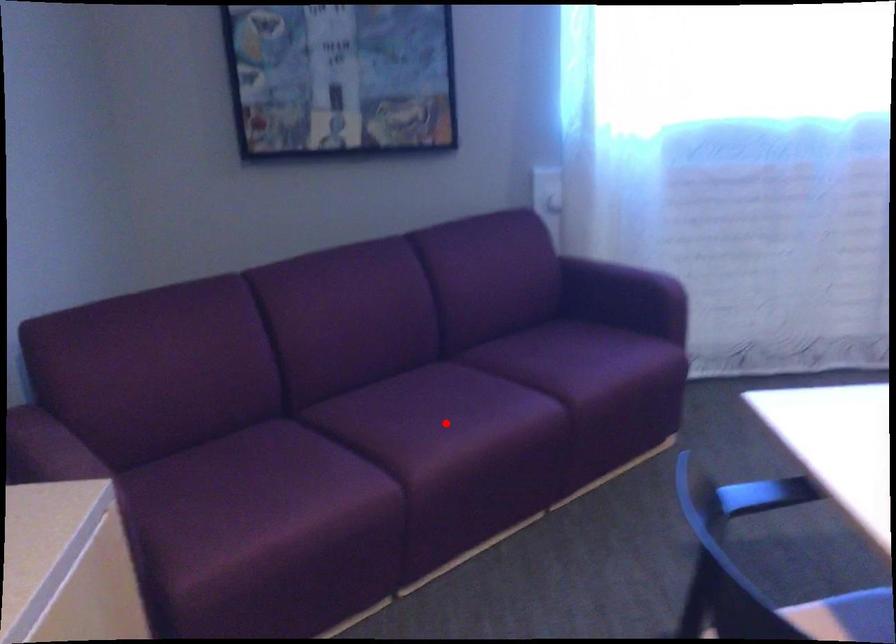
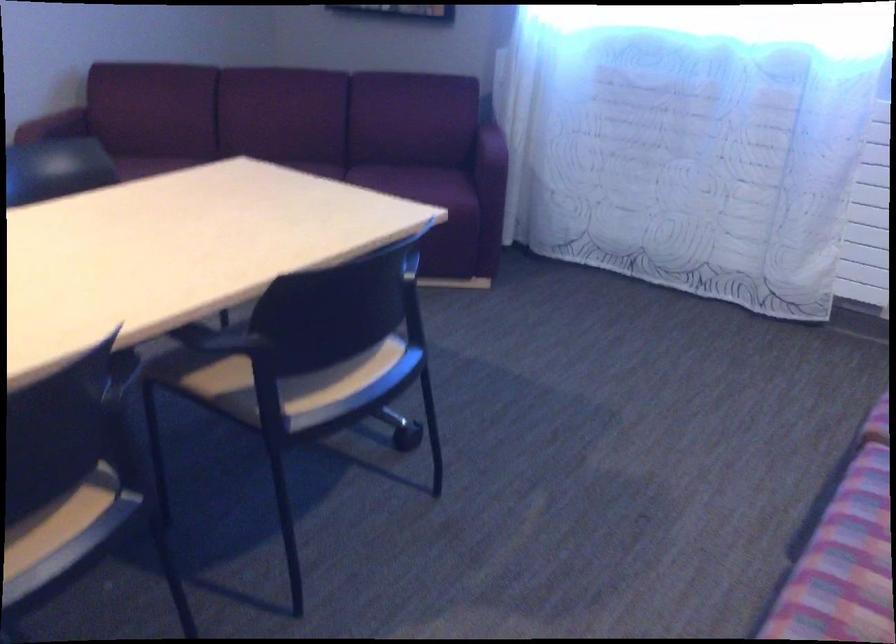
Question: I am providing you with two images of the same scene from different viewpoints. A red point is marked on the first image. Can you still see the location of the red point in image 2?

Choices:
 (A) Yes
 (B) No

Answer: (B)